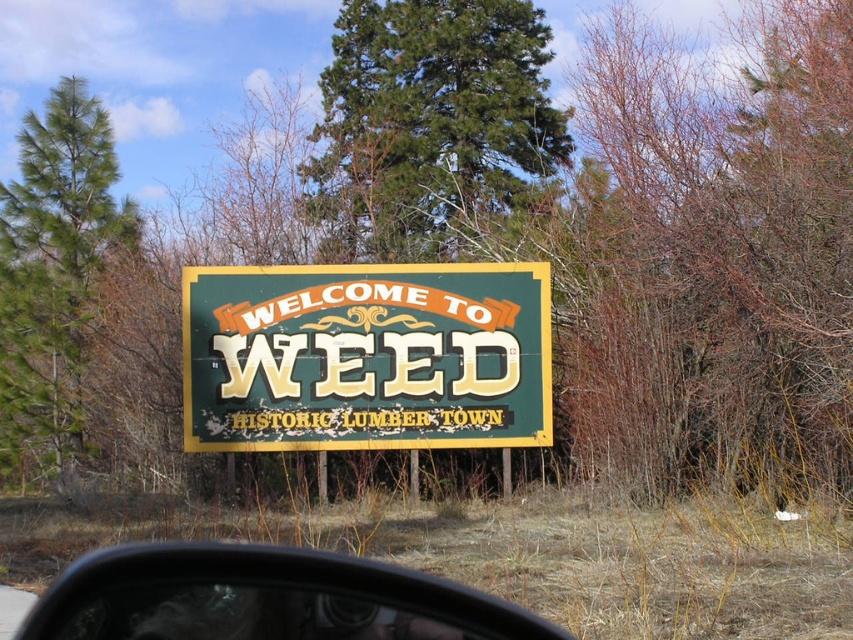
Question: From the image, what is the correct spatial relationship of transparent plastic side mirror at lower center in relation to green pine tree at left?

Choices:
 (A) below
 (B) above

Answer: (A)

Question: Which of the following is the farthest from the observer?

Choices:
 (A) green vintage sign at center
 (B) green pine tree at center
 (C) green pine tree at left
 (D) transparent plastic side mirror at lower center

Answer: (B)

Question: Which object is closer to the camera taking this photo?

Choices:
 (A) green vintage sign at center
 (B) green pine tree at center
 (C) transparent plastic side mirror at lower center

Answer: (C)

Question: From the image, what is the correct spatial relationship of green pine tree at center in relation to green pine tree at left?

Choices:
 (A) above
 (B) below

Answer: (A)

Question: Can you confirm if green vintage sign at center is positioned above transparent plastic side mirror at lower center?

Choices:
 (A) yes
 (B) no

Answer: (A)

Question: Which of the following is the closest to the observer?

Choices:
 (A) transparent plastic side mirror at lower center
 (B) green pine tree at center

Answer: (A)